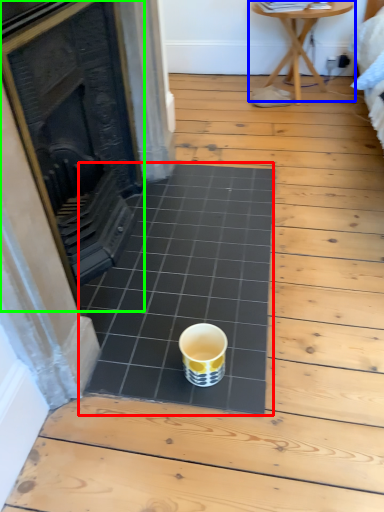
Question: Which object is positioned farthest from ceramic tile (highlighted by a red box)? Select from table (highlighted by a blue box) and fireplace (highlighted by a green box).

Choices:
 (A) table
 (B) fireplace

Answer: (A)